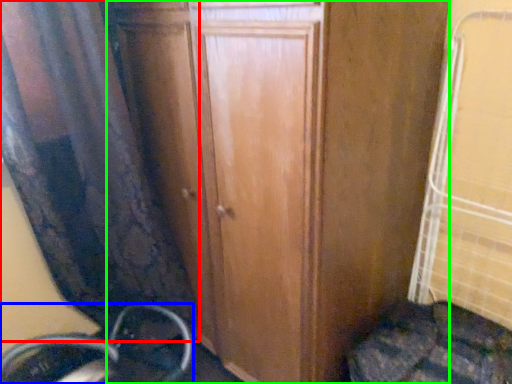
Question: Considering the real-world distances, which object is closest to curtain (highlighted by a red box)? wheel (highlighted by a blue box) or door (highlighted by a green box).

Choices:
 (A) wheel
 (B) door

Answer: (B)